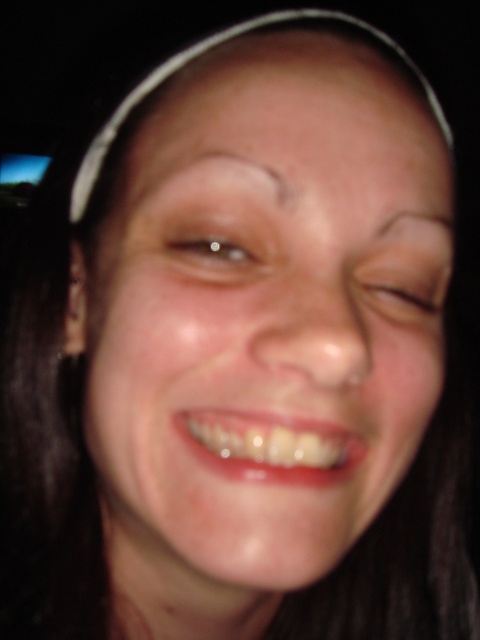
Based on the scene description, which object is positioned higher up on the face between the smooth skin at center and the brown matte eyebrow at upper center?

The brown matte eyebrow at upper center is positioned higher up on the face than the smooth skin at center.

You are a photographer adjusting lighting for a portrait. You notice the subject has two areas labeled as smooth skin face at center and smooth skin at center. Which area should you focus your lighting on to ensure even illumination?

Both areas are the same since smooth skin face at center and smooth skin at center refer to the same region on the subject.